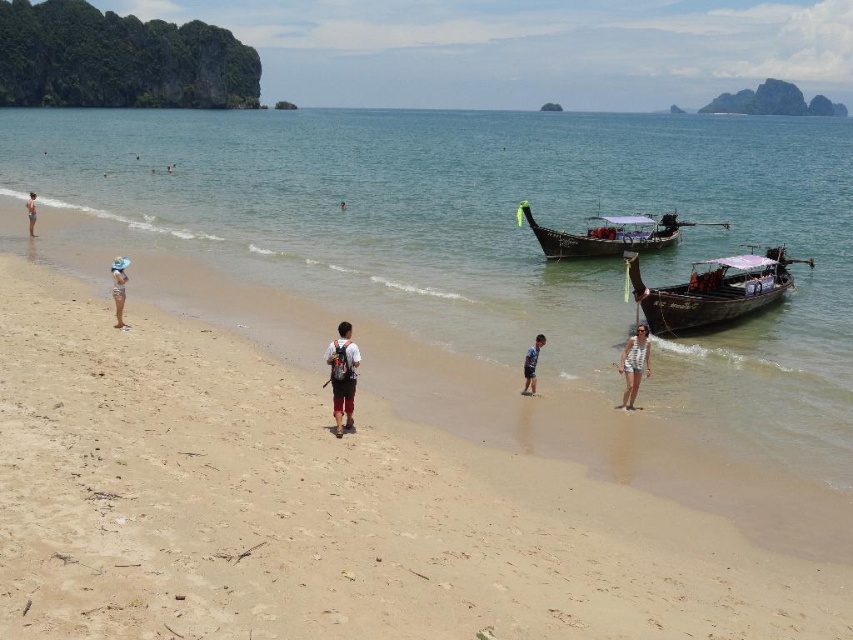
You are a photographer trying to capture both the wooden polished boat at lower right and the white fabric hat at left in the same frame. Based on their sizes in the image, which object should you focus on first to ensure both fit in the frame?

The wooden polished boat at lower right is shorter than the white fabric hat at left, so you should focus on the white fabric hat at left first to ensure both fit in the frame since it is larger and requires more space.